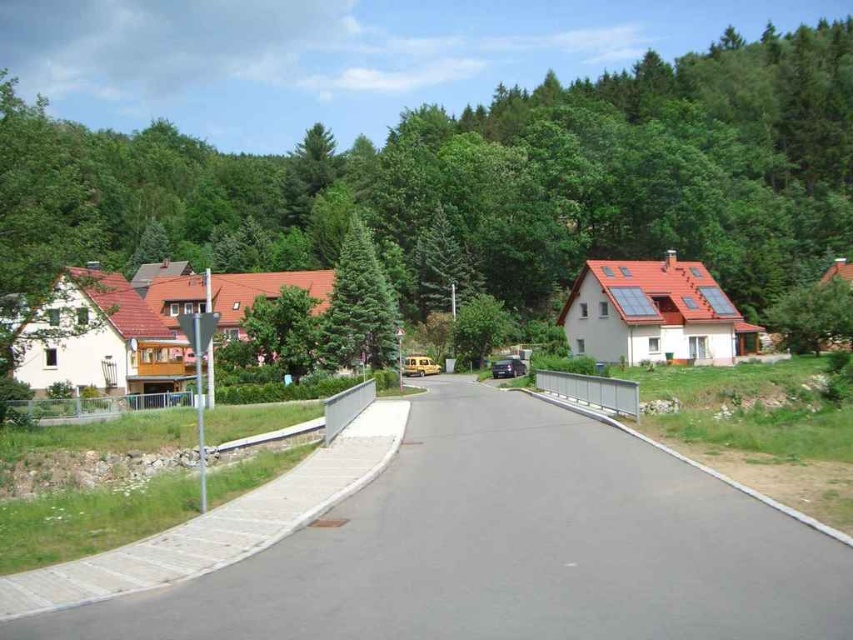
You are standing at the center of the road in the suburban scene. You want to find the green textured pine tree at center. In which direction should you look to see it?

The green textured pine tree at center is located at the center of the image, so you should look straight ahead to see it.

You are a delivery driver approaching the small bridge in the suburban scene. You need to pass under the green textured pine tree at center while driving the metallic silver car at center. Can the car safely pass under the tree without hitting it?

The green textured pine tree at center is taller than the metallic silver car at center, so the metallic silver car at center can safely pass under the tree without hitting it.